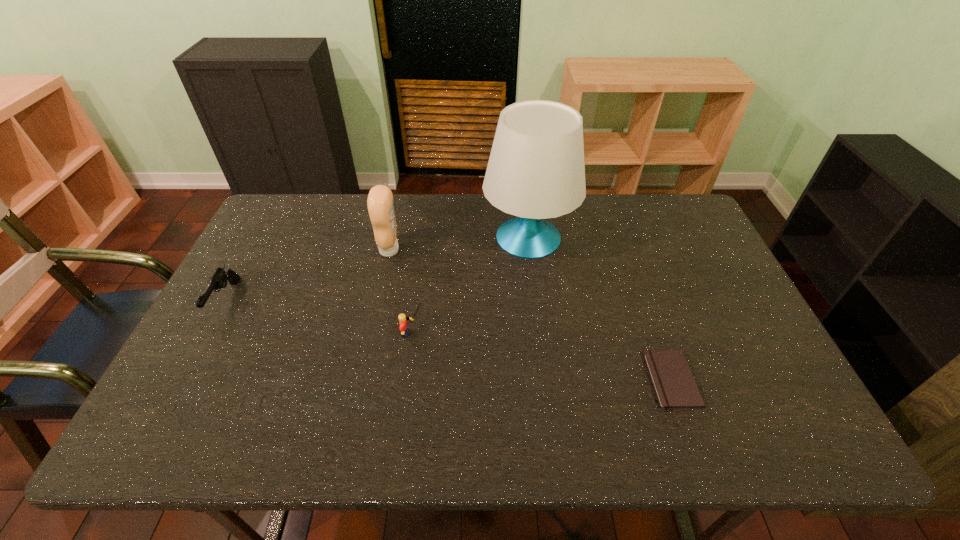
The image size is (960, 540). I want to click on the second object from right to left, so click(x=536, y=170).

You are a GUI agent. You are given a task and a screenshot of the screen. Output one action in this format:
    pyautogui.click(x=<x>, y=<y>)
    Task: Click on the tallest object
    The image size is (960, 540).
    Given the screenshot: What is the action you would take?
    pyautogui.click(x=536, y=170)

Where is `the fourth object from right to left`? This screenshot has height=540, width=960. the fourth object from right to left is located at coordinates (380, 204).

Where is `the second tallest object`? The height and width of the screenshot is (540, 960). the second tallest object is located at coordinates (380, 204).

Where is `Lego`? Image resolution: width=960 pixels, height=540 pixels. Lego is located at coordinates (403, 319).

Locate an element on the screen. The height and width of the screenshot is (540, 960). the third object from right to left is located at coordinates (403, 319).

This screenshot has height=540, width=960. In order to click on the leftmost object in this screenshot , I will do `click(218, 280)`.

I want to click on the third farthest object, so click(x=218, y=280).

Find the location of a particular element. The image size is (960, 540). the shortest object is located at coordinates (675, 387).

Locate an element on the screen. The image size is (960, 540). the rightmost object is located at coordinates (675, 387).